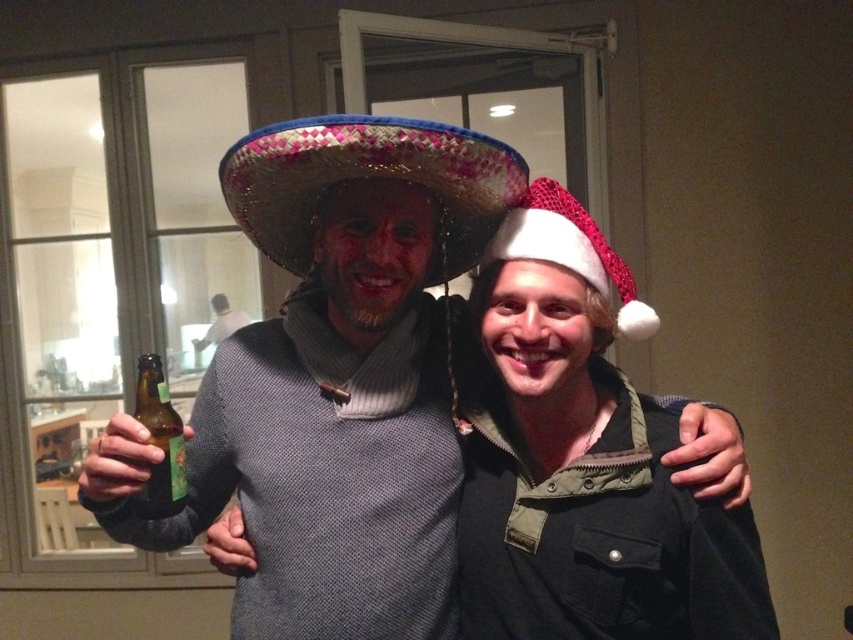
Question: Does bright pink woven sombrero at center appear over green matte beer bottle at center?

Choices:
 (A) no
 (B) yes

Answer: (B)

Question: Among these points, which one is nearest to the camera?

Choices:
 (A) [265, 202]
 (B) [553, 260]

Answer: (B)

Question: Can you confirm if fuzzy straw sombrero at right is positioned to the right of green matte beer bottle at center?

Choices:
 (A) no
 (B) yes

Answer: (B)

Question: Is matte straw sombrero at center thinner than fuzzy straw sombrero at right?

Choices:
 (A) yes
 (B) no

Answer: (B)

Question: Among these objects, which one is nearest to the camera?

Choices:
 (A) white felt santa hat at right
 (B) fuzzy straw sombrero at right
 (C) bright pink woven sombrero at center
 (D) green matte beer bottle at center

Answer: (C)

Question: Among these points, which one is nearest to the camera?

Choices:
 (A) (146, 372)
 (B) (274, 340)
 (C) (483, 257)
 (D) (459, 148)

Answer: (D)